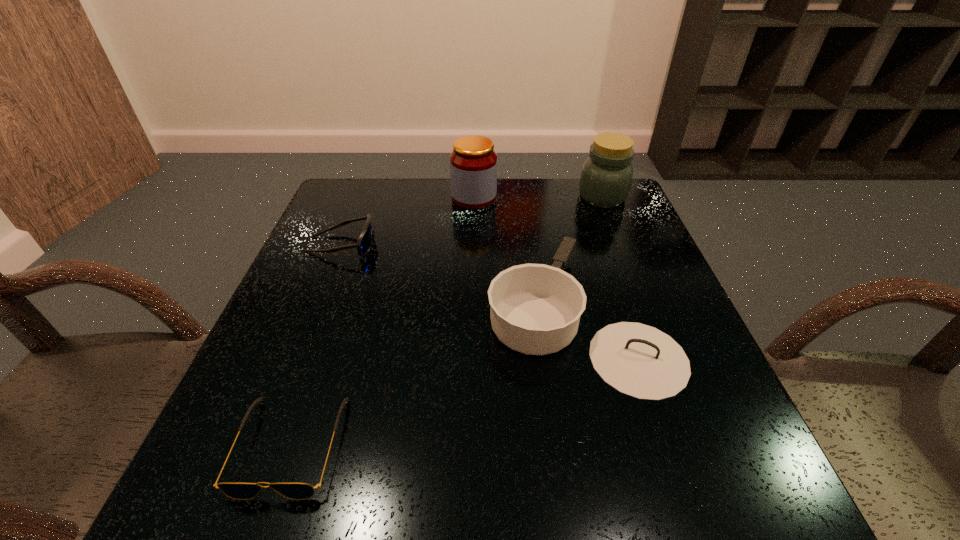
Image resolution: width=960 pixels, height=540 pixels. What are the coordinates of `the right jar` in the screenshot? It's located at (606, 176).

Where is `the left jar`? the left jar is located at coordinates (473, 162).

Locate an element on the screen. the third shortest object is located at coordinates (535, 309).

Where is `the fourth tallest object`? the fourth tallest object is located at coordinates (364, 242).

The width and height of the screenshot is (960, 540). What are the coordinates of `the farther sunglasses` in the screenshot? It's located at (364, 242).

Where is `the shortest object`? Image resolution: width=960 pixels, height=540 pixels. the shortest object is located at coordinates (293, 490).

The image size is (960, 540). I want to click on the nearer sunglasses, so click(293, 490).

Identify the location of vacant space located on the left of the right jar. The height and width of the screenshot is (540, 960). (444, 197).

Image resolution: width=960 pixels, height=540 pixels. I want to click on vacant space situated 0.110m on the right of the left jar, so click(536, 198).

Find the location of a particular element. The image size is (960, 540). blank space located 0.110m on the back of the saucepan is located at coordinates (558, 227).